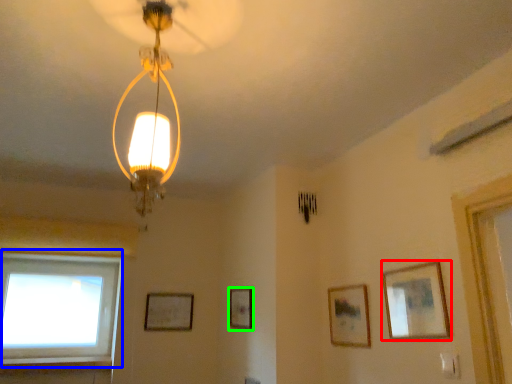
Question: Based on their relative distances, which object is farther from picture frame (highlighted by a red box)? Choose from window (highlighted by a blue box) and picture frame (highlighted by a green box).

Choices:
 (A) window
 (B) picture frame

Answer: (A)